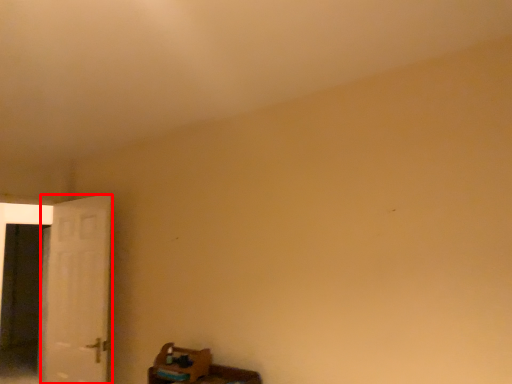
Question: Considering the relative positions of door (annotated by the red box) and screen door in the image provided, where is door (annotated by the red box) located with respect to the staircase?

Choices:
 (A) left
 (B) right

Answer: (B)